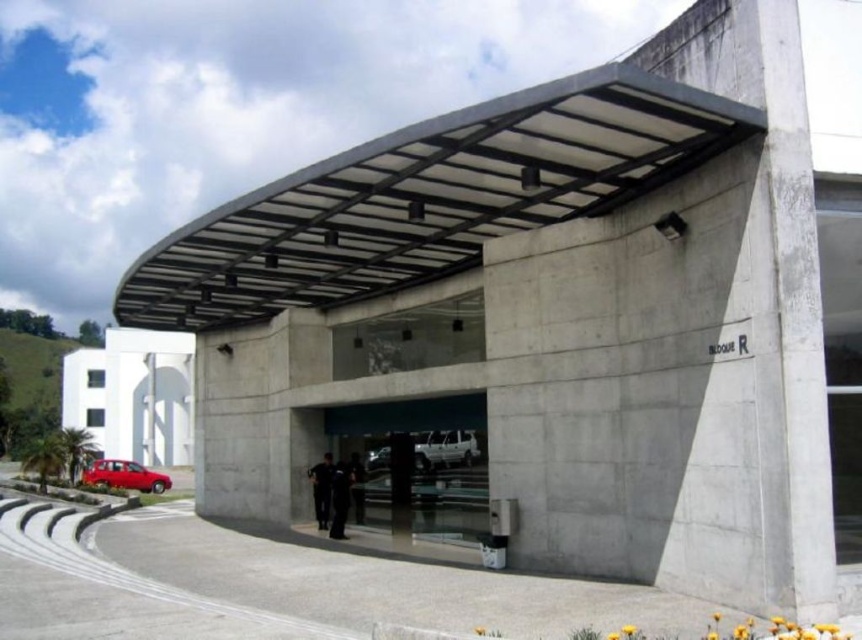
Is white concrete building at upper left positioned before black matte pants at center?

That is False.

Which is behind, point (92, 390) or point (348, 504)?

The point (92, 390) is more distant.

Is point (141, 451) closer to camera compared to point (342, 496)?

No, (141, 451) is behind (342, 496).

Locate an element on the screen. The width and height of the screenshot is (862, 640). white concrete building at upper left is located at coordinates 132,394.

Can you confirm if white concrete building at upper left is smaller than black matte jacket at center?

No, white concrete building at upper left is not smaller than black matte jacket at center.

Who is positioned more to the right, white concrete building at upper left or black matte jacket at center?

Positioned to the right is black matte jacket at center.

Image resolution: width=862 pixels, height=640 pixels. I want to click on white concrete building at upper left, so click(132, 394).

Can you confirm if shiny red car at lower left is positioned above black matte uniform at center?

Incorrect, shiny red car at lower left is not positioned above black matte uniform at center.

Which is in front, point (92, 483) or point (360, 468)?

Positioned in front is point (360, 468).

Where is `shiny red car at lower left`? This screenshot has width=862, height=640. shiny red car at lower left is located at coordinates (125, 476).

Where is `shiny red car at lower left`? shiny red car at lower left is located at coordinates (125, 476).